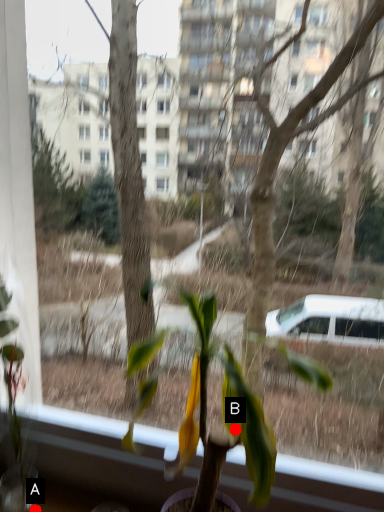
Question: Two points are circled on the image, labeled by A and B beside each circle. Which point is farther from the camera taking this photo?

Choices:
 (A) A is further
 (B) B is further

Answer: (A)